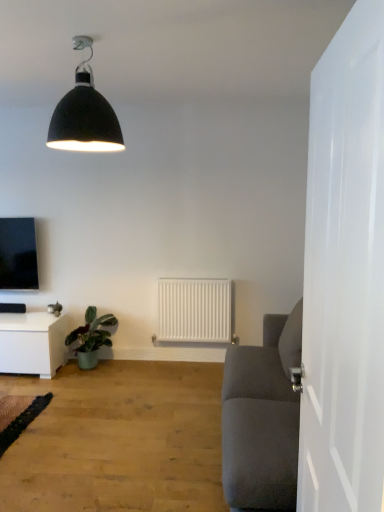
You are a GUI agent. You are given a task and a screenshot of the screen. Output one action in this format:
    pyautogui.click(x=<x>, y=<y>)
    Task: Click on the vacant space in front of green glossy plant at lower left
    The height and width of the screenshot is (512, 384).
    Given the screenshot: What is the action you would take?
    pyautogui.click(x=69, y=385)